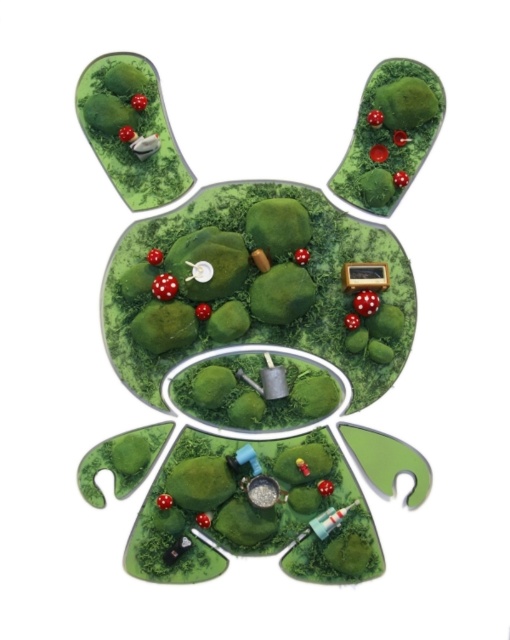
You are a tiny gardener standing in the miniature rabbit garden. You notice the matte white mushroom at upper left and the matte green mushroom at upper right. Which mushroom is closer to you?

The matte white mushroom at upper left is closer to the viewer than the matte green mushroom at upper right.

Looking at this image, you are a tiny gardener standing in the miniature rabbit garden. You need to place a new red flower between the matte white mushroom at upper left and the matte green mushroom at upper right. Which direction should you move from the white mushroom to reach the spot where the flower should go?

You should move to the right from the matte white mushroom at upper left towards the matte green mushroom at upper right to place the new red flower between them.

You are standing in the miniature garden shaped like a rabbit. You notice two points marked in the scene. The first point is at coordinates point (x=125, y=138) and the second is at point (x=379, y=113). Which point is closer to you as you face the garden?

Point (x=379, y=113) is closer to you because it is in front of point (x=125, y=138).